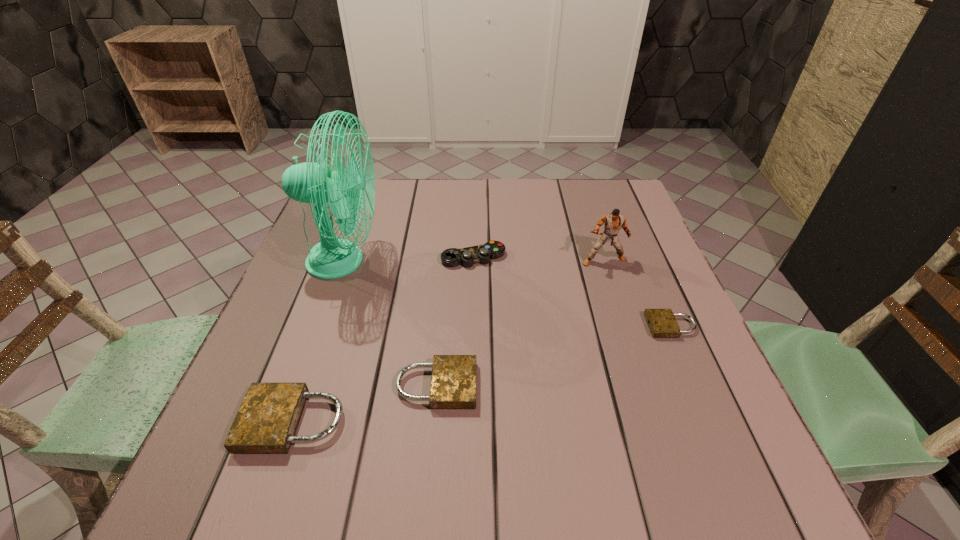
Find the location of `the leftmost padlock`. the leftmost padlock is located at coordinates (266, 423).

Where is `the second tallest padlock`? The image size is (960, 540). the second tallest padlock is located at coordinates (453, 383).

Where is `the farthest padlock`? Image resolution: width=960 pixels, height=540 pixels. the farthest padlock is located at coordinates (662, 323).

Find the location of a particular element. Image resolution: width=960 pixels, height=540 pixels. the shortest object is located at coordinates (662, 323).

Find the location of `fan`. fan is located at coordinates (333, 257).

Where is `puncher`? The height and width of the screenshot is (540, 960). puncher is located at coordinates click(613, 222).

At what (x,y) coordinates should I click in order to perform the action: click on control. Please return your answer as a coordinate pair (x, y). The width and height of the screenshot is (960, 540). Looking at the image, I should click on (x=467, y=256).

Where is `blank area located 0.090m on the keyhole side of the second padlock from left to right`? blank area located 0.090m on the keyhole side of the second padlock from left to right is located at coordinates (524, 386).

Where is `vacant space positioned on the keyhole side of the farthest padlock`? Image resolution: width=960 pixels, height=540 pixels. vacant space positioned on the keyhole side of the farthest padlock is located at coordinates (583, 326).

Locate an element on the screen. vacant area situated on the keyhole side of the farthest padlock is located at coordinates (583, 326).